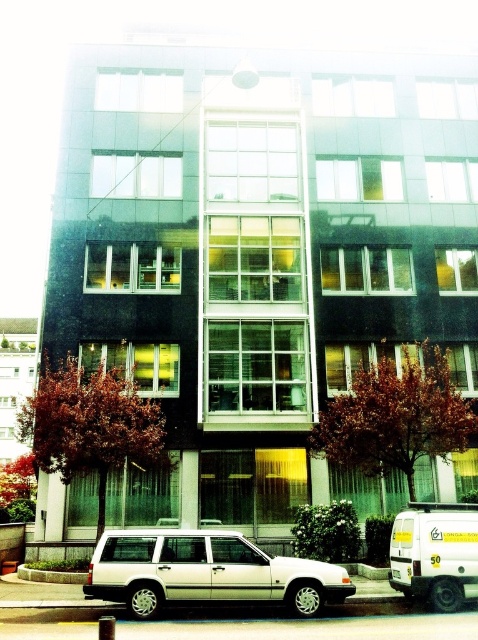
Is silver metallic station wagon at lower center taller than white matte van at lower right?

Incorrect, silver metallic station wagon at lower center's height is not larger of white matte van at lower right's.

Can you confirm if silver metallic station wagon at lower center is positioned above white matte van at lower right?

No, silver metallic station wagon at lower center is not above white matte van at lower right.

Find the location of `silver metallic station wagon at lower center`. silver metallic station wagon at lower center is located at coordinates (206, 572).